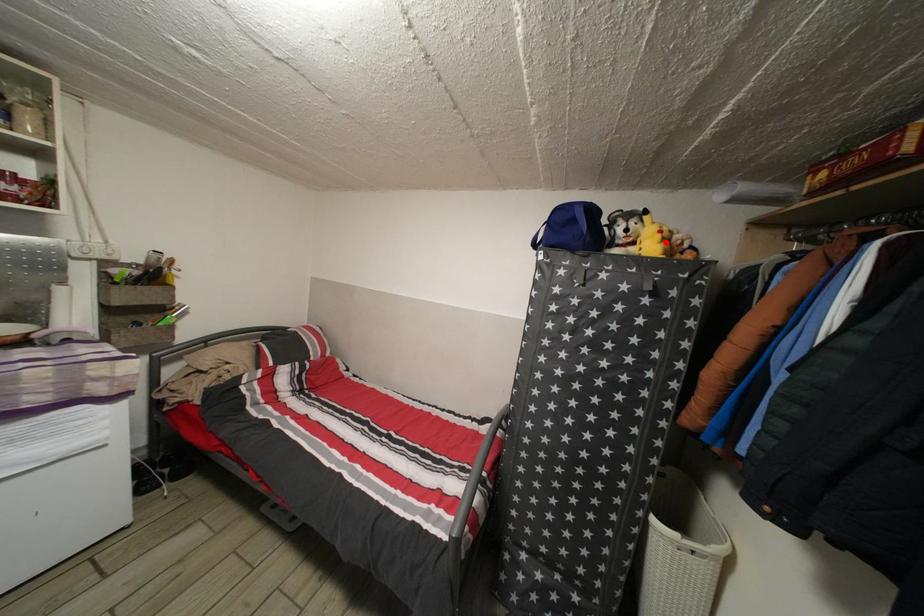
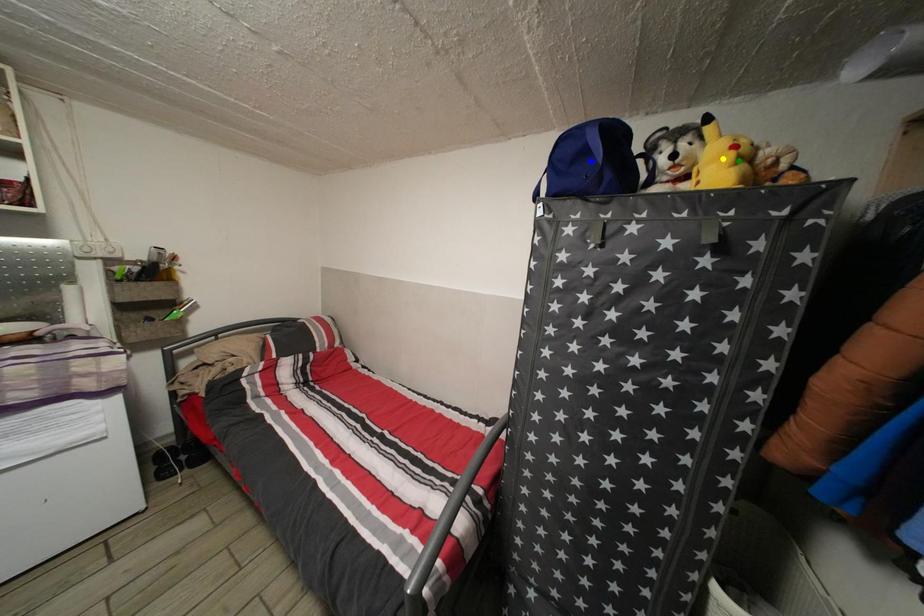
Question: I am providing you with two images of the same scene from different viewpoints. A red point is marked on the first image. You are given multiple points on the second image. Which point in image 2 is actually the same real-world point as the red point in image 1?

Choices:
 (A) green point
 (B) yellow point
 (C) blue point

Answer: (A)